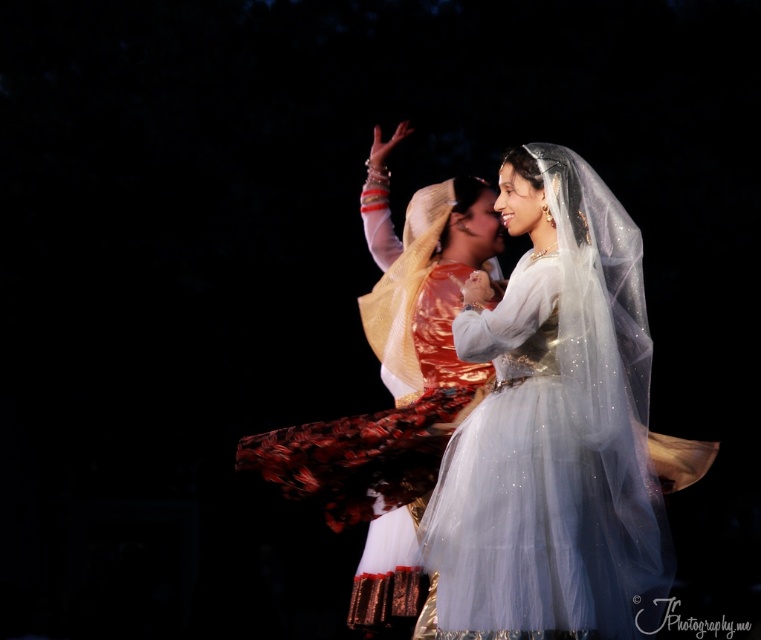
Can you confirm if silvery tulle dress at center is bigger than matte gold veil at center?

No.

Is silvery tulle dress at center taller than matte gold veil at center?

No, silvery tulle dress at center is not taller than matte gold veil at center.

You are a GUI agent. You are given a task and a screenshot of the screen. Output one action in this format:
    pyautogui.click(x=<x>, y=<y>)
    Task: Click on the silvery tulle dress at center
    Image resolution: width=761 pixels, height=640 pixels.
    Given the screenshot: What is the action you would take?
    pyautogui.click(x=553, y=432)

You are a GUI agent. You are given a task and a screenshot of the screen. Output one action in this format:
    pyautogui.click(x=<x>, y=<y>)
    Task: Click on the silvery tulle dress at center
    The image size is (761, 640).
    Given the screenshot: What is the action you would take?
    pyautogui.click(x=553, y=432)